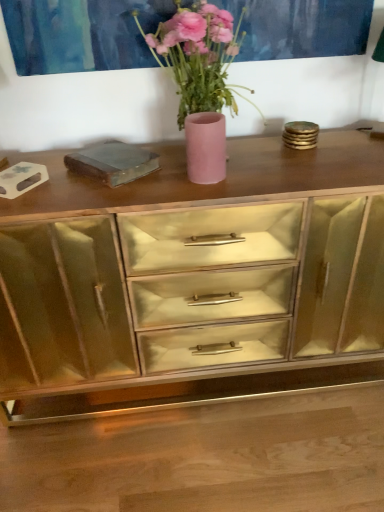
The width and height of the screenshot is (384, 512). What are the coordinates of `free spot to the left of matte pink vase at center` in the screenshot? It's located at (148, 188).